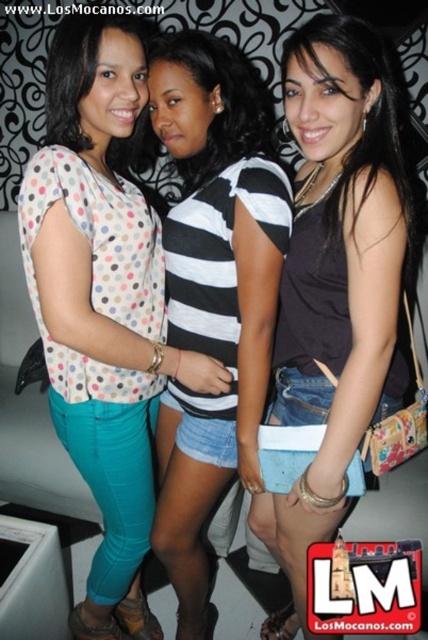
Based on the photo, you are standing in the same room as the three people in the image and want to move closer to the camera. Which point should you walk towards, point (160,326) or point (252,109)?

You should walk towards point (160,326) because it is closer to the camera than point (252,109).

You are a photographer trying to focus on the dark brown leather tank top at center. What coordinates should you aim your camera at to ensure it is centered in the frame?

The dark brown leather tank top at center is located at coordinates point (336, 276), so you should aim your camera at those coordinates to center it in the frame.